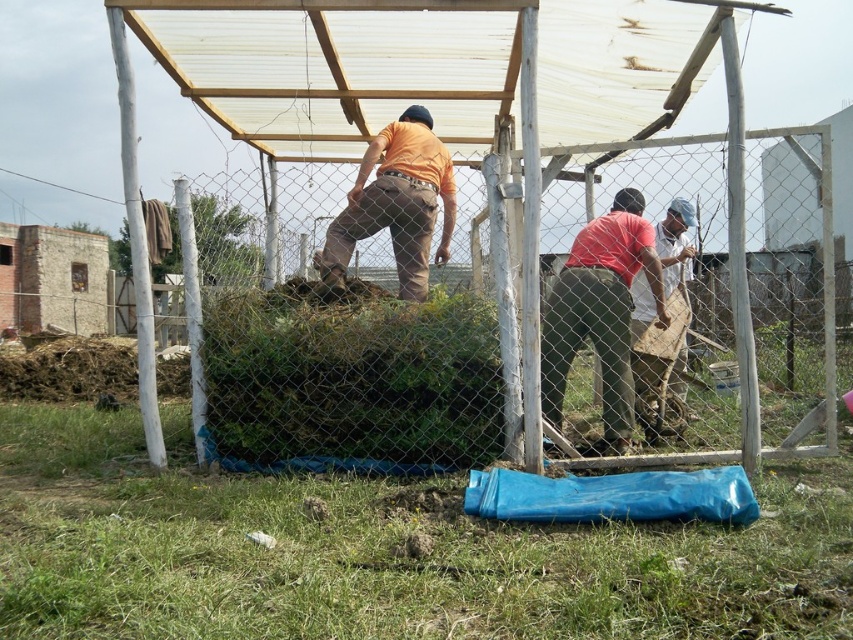
You are a landscape architect observing the outdoor scene. You notice the green leafy hedge at center and the orange matte shirt at center. Which object is located to the right of the other?

The green leafy hedge at center is positioned on the left side of orange matte shirt at center, so the orange matte shirt at center is to the right of the green leafy hedge at center.

You are standing at the base of the structure and want to reach both the point at coordinates point (605, 385) and point (194, 422). Which point will you encounter first as you move forward?

You will encounter point (194, 422) first because it is closer to you than point (605, 385), which is further away.

You are a photographer trying to capture the matte pink shirt at center under the transparent plastic canopy at upper center. Since the canopy is to the left of the shirt, will the sunlight filtering through the canopy hit the shirt from the right or left side?

The transparent plastic canopy at upper center is to the left of the matte pink shirt at center, so the sunlight filtering through the canopy will hit the shirt from the left side.